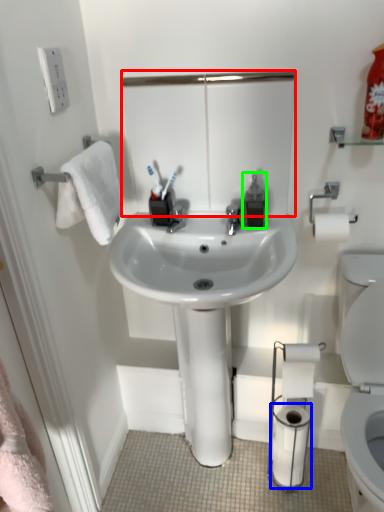
Question: Based on their relative distances, which object is nearer to mirror (highlighted by a red box)? Choose from toilet paper (highlighted by a blue box) and soap dispenser (highlighted by a green box).

Choices:
 (A) toilet paper
 (B) soap dispenser

Answer: (B)